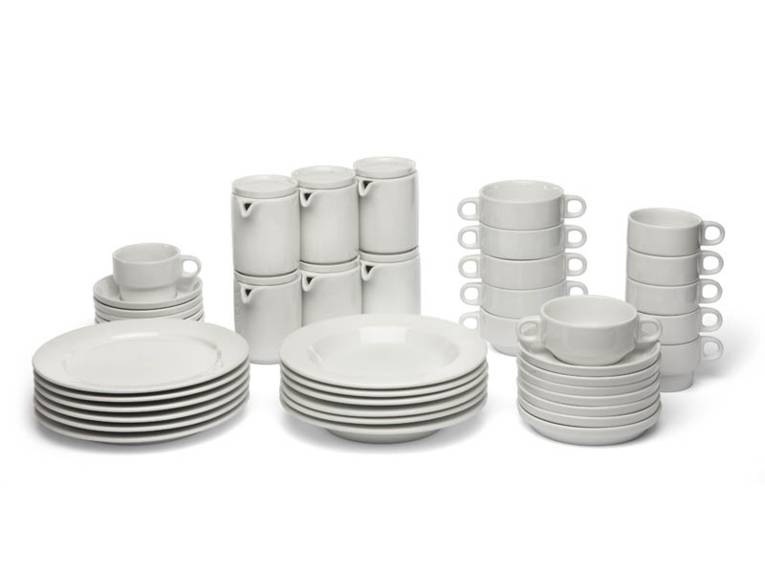
The image size is (765, 574). What are the coordinates of `dinner plates` in the screenshot? It's located at (165, 436), (164, 429), (163, 420), (163, 405), (194, 393), (210, 378).